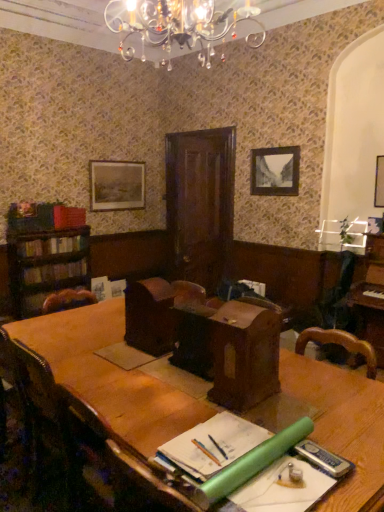
I want to click on free space in front of brown leather armchair at center, the first armchair when ordered from left to right, so click(x=145, y=361).